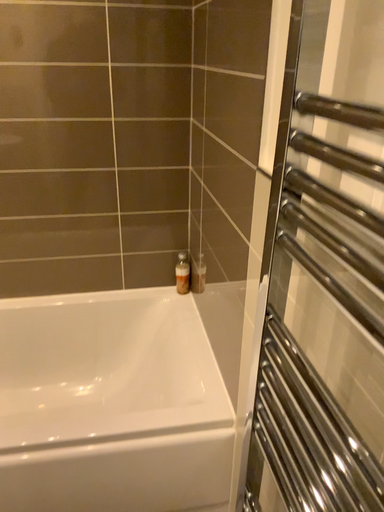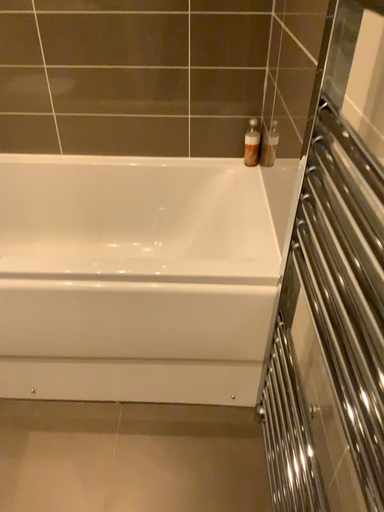
Question: How did the camera likely rotate when shooting the video?

Choices:
 (A) rotated right
 (B) rotated left

Answer: (B)